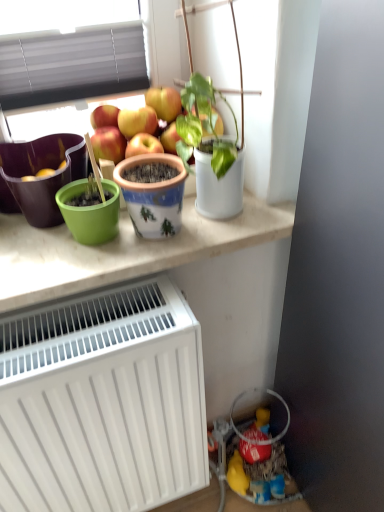
Question: Does white matte radiator at lower left have a larger size compared to green plastic pot at upper center?

Choices:
 (A) yes
 (B) no

Answer: (A)

Question: Can you confirm if white matte radiator at lower left is positioned to the left of green plastic pot at upper center?

Choices:
 (A) yes
 (B) no

Answer: (A)

Question: Does white matte radiator at lower left have a greater width compared to green plastic pot at upper center?

Choices:
 (A) no
 (B) yes

Answer: (A)

Question: Can you confirm if white matte radiator at lower left is shorter than green plastic pot at upper center?

Choices:
 (A) yes
 (B) no

Answer: (B)

Question: From a real-world perspective, is white matte radiator at lower left under green plastic pot at upper center?

Choices:
 (A) yes
 (B) no

Answer: (A)

Question: From a real-world perspective, relative to white matte radiator at lower left, is green matte flowerpot at left, which is the 2th flowerpot in right-to-left order, vertically above or below?

Choices:
 (A) below
 (B) above

Answer: (B)

Question: Looking at their shapes, would you say green matte flowerpot at left, which is the 2th flowerpot in right-to-left order, is wider or thinner than white matte radiator at lower left?

Choices:
 (A) wide
 (B) thin

Answer: (B)

Question: In terms of size, does green matte flowerpot at left, which is the 2th flowerpot in right-to-left order, appear bigger or smaller than white matte radiator at lower left?

Choices:
 (A) big
 (B) small

Answer: (B)

Question: Is green matte flowerpot at left, which is the 2th flowerpot in right-to-left order, taller or shorter than white matte radiator at lower left?

Choices:
 (A) tall
 (B) short

Answer: (B)

Question: Relative to painted ceramic pot at center, which ranks as the 1th flowerpot in right-to-left order, is green matte flowerpot at left, the first flowerpot positioned from the left, in front or behind?

Choices:
 (A) behind
 (B) front

Answer: (A)

Question: Is green matte flowerpot at left, which is the 2th flowerpot in right-to-left order, inside the boundaries of painted ceramic pot at center, which ranks as the 1th flowerpot in right-to-left order, or outside?

Choices:
 (A) inside
 (B) outside

Answer: (B)

Question: From the image's perspective, is green matte flowerpot at left, which is the 2th flowerpot in right-to-left order, above or below painted ceramic pot at center, which ranks as the 1th flowerpot in right-to-left order?

Choices:
 (A) above
 (B) below

Answer: (A)

Question: Visually, is green matte flowerpot at left, the first flowerpot positioned from the left, positioned to the left or to the right of painted ceramic pot at center, which ranks as the 1th flowerpot in right-to-left order?

Choices:
 (A) right
 (B) left

Answer: (B)

Question: Relative to green matte flowerpot at left, the first flowerpot positioned from the left, is green plastic pot at upper center in front or behind?

Choices:
 (A) behind
 (B) front

Answer: (B)

Question: Considering the positions of green plastic pot at upper center and green matte flowerpot at left, the first flowerpot positioned from the left, in the image, is green plastic pot at upper center bigger or smaller than green matte flowerpot at left, the first flowerpot positioned from the left,?

Choices:
 (A) big
 (B) small

Answer: (A)